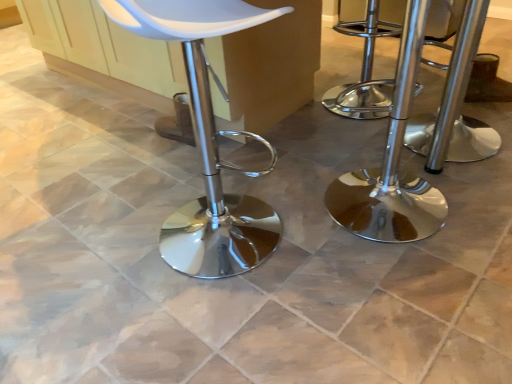
This screenshot has height=384, width=512. Identify the location of vacant space to the right of white matte stool at center. (316, 236).